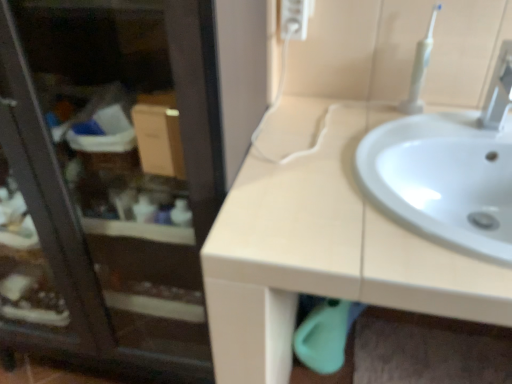
Find the location of a particular element. free space behind white plastic tap at upper right is located at coordinates (456, 121).